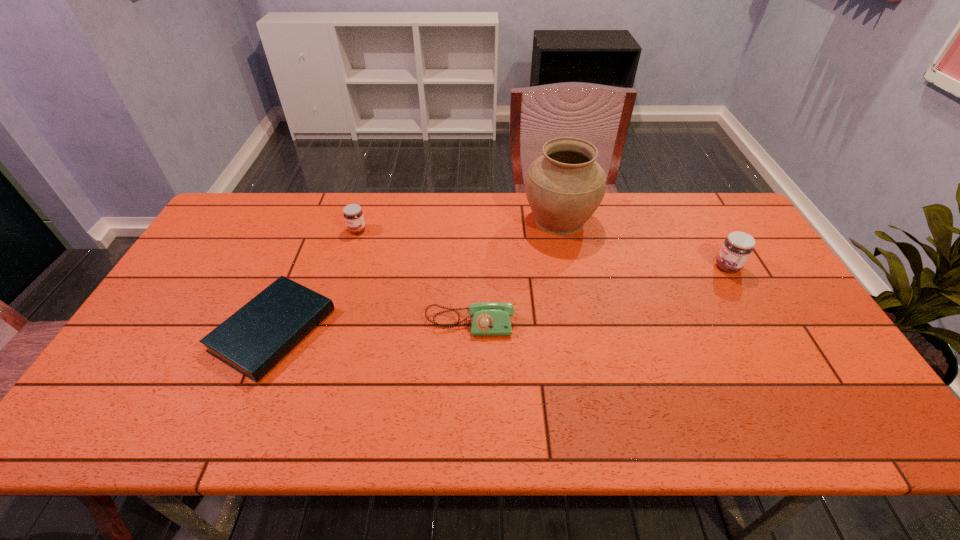
Find the location of a particular element. The height and width of the screenshot is (540, 960). free region located 0.080m on the front label of the nearer jam is located at coordinates (688, 267).

At what (x,y) coordinates should I click in order to perform the action: click on blank area located 0.270m on the front label of the nearer jam. Please return your answer as a coordinate pair (x, y). This screenshot has height=540, width=960. Looking at the image, I should click on (625, 267).

Where is `free point located 0.400m on the front label of the nearer jam`? free point located 0.400m on the front label of the nearer jam is located at coordinates coord(582,267).

Where is `free spot located 0.320m on the left of the farther jam`? The height and width of the screenshot is (540, 960). free spot located 0.320m on the left of the farther jam is located at coordinates (251, 230).

Identify the location of blank area located 0.140m on the dial of the third object from right to left. (468, 385).

You are a GUI agent. You are given a task and a screenshot of the screen. Output one action in this format:
    pyautogui.click(x=<x>, y=<y>)
    Task: Click on the free space located 0.300m on the back of the shortest object
    
    Given the screenshot: What is the action you would take?
    pyautogui.click(x=319, y=221)

You are a GUI agent. You are given a task and a screenshot of the screen. Output one action in this format:
    pyautogui.click(x=<x>, y=<y>)
    Task: Click on the urn present at the far edge
    Image resolution: width=960 pixels, height=540 pixels.
    Given the screenshot: What is the action you would take?
    pyautogui.click(x=564, y=187)

Where is `jam positioned at the far edge`? The height and width of the screenshot is (540, 960). jam positioned at the far edge is located at coordinates (353, 215).

The image size is (960, 540). I want to click on object located at the right edge, so click(736, 249).

Where is `free space at the far edge of the desktop`? This screenshot has height=540, width=960. free space at the far edge of the desktop is located at coordinates (407, 212).